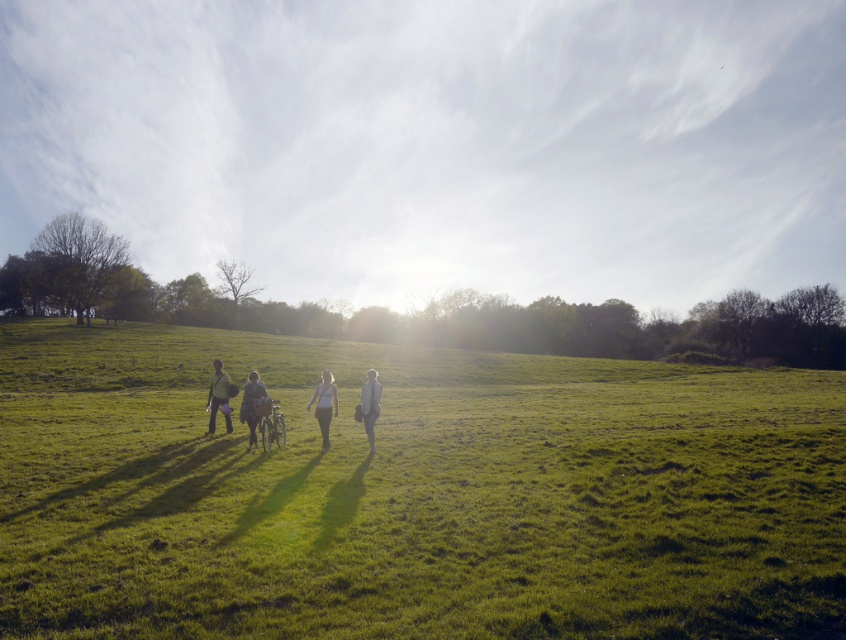
Question: Among these objects, which one is farthest from the camera?

Choices:
 (A) white matte shirt at center
 (B) green grass at center
 (C) brown leather jacket at center

Answer: (C)

Question: Does brown leather jacket at center have a greater width compared to green fabric shirt at center?

Choices:
 (A) yes
 (B) no

Answer: (B)

Question: From the image, what is the correct spatial relationship of green grass at center in relation to brown leather jacket at center?

Choices:
 (A) below
 (B) above

Answer: (A)

Question: Does brown leather jacket at center lie in front of green fabric shirt at center?

Choices:
 (A) no
 (B) yes

Answer: (B)

Question: Which point is farther to the camera?

Choices:
 (A) green grass at center
 (B) brown leather jacket at center
 (C) light gray fabric jacket at center

Answer: (B)

Question: Considering the real-world distances, which object is farthest from the light gray fabric jacket at center?

Choices:
 (A) green fabric shirt at center
 (B) brown leather jacket at center
 (C) white matte shirt at center

Answer: (A)